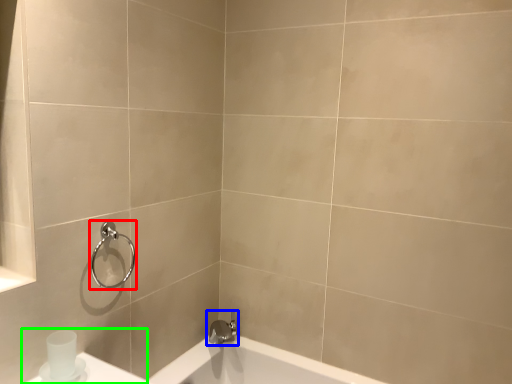
Question: Which object is positioned farthest from shower (highlighted by a red box)? Select from tap (highlighted by a blue box) and sink (highlighted by a green box).

Choices:
 (A) tap
 (B) sink

Answer: (A)